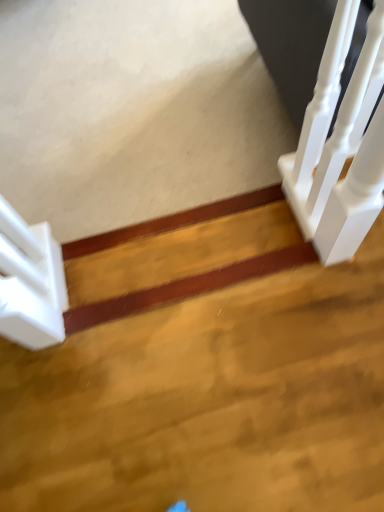
Question: Is white glossy stairwell at upper right completely or partially outside of white glossy stair at left?

Choices:
 (A) no
 (B) yes

Answer: (B)

Question: Is white glossy stairwell at upper right not near white glossy stair at left?

Choices:
 (A) no
 (B) yes

Answer: (A)

Question: Does white glossy stairwell at upper right come in front of white glossy stair at left?

Choices:
 (A) no
 (B) yes

Answer: (B)

Question: Considering the relative positions of white glossy stairwell at upper right and white glossy stair at left in the image provided, is white glossy stairwell at upper right behind white glossy stair at left?

Choices:
 (A) no
 (B) yes

Answer: (A)

Question: Does white glossy stairwell at upper right appear on the right side of white glossy stair at left?

Choices:
 (A) yes
 (B) no

Answer: (A)

Question: Would you say white glossy stairwell at upper right contains white glossy stair at left?

Choices:
 (A) yes
 (B) no

Answer: (B)

Question: Is white glossy stairwell at upper right inside white glossy stair at left?

Choices:
 (A) no
 (B) yes

Answer: (A)

Question: Is white glossy stair at left located outside white glossy stairwell at upper right?

Choices:
 (A) yes
 (B) no

Answer: (A)

Question: From a real-world perspective, is white glossy stair at left under white glossy stairwell at upper right?

Choices:
 (A) no
 (B) yes

Answer: (B)

Question: Is white glossy stair at left positioned before white glossy stairwell at upper right?

Choices:
 (A) no
 (B) yes

Answer: (A)

Question: Is white glossy stair at left to the left of white glossy stairwell at upper right from the viewer's perspective?

Choices:
 (A) yes
 (B) no

Answer: (A)

Question: Is white glossy stair at left aimed at white glossy stairwell at upper right?

Choices:
 (A) no
 (B) yes

Answer: (B)

Question: Considering the positions of white glossy stair at left and white glossy stairwell at upper right in the image, is white glossy stair at left bigger or smaller than white glossy stairwell at upper right?

Choices:
 (A) small
 (B) big

Answer: (A)